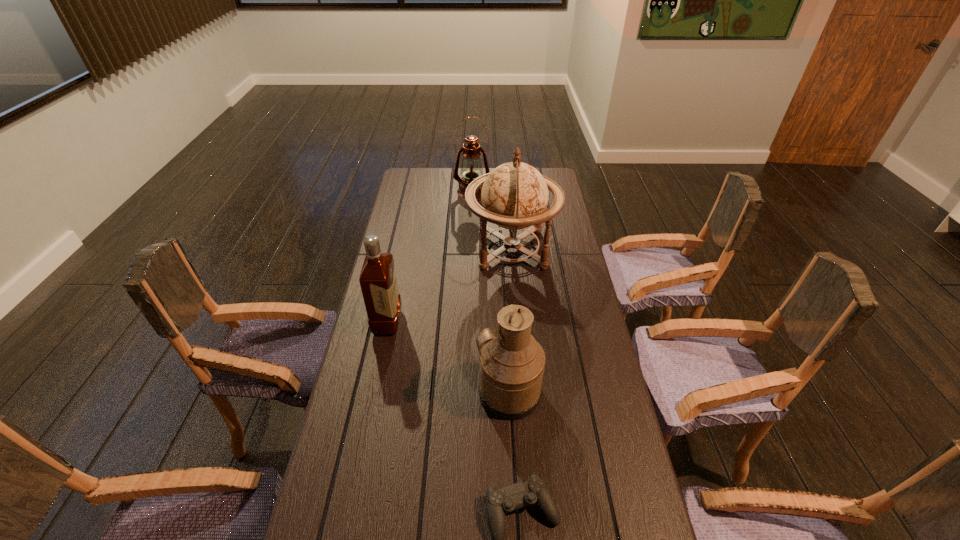
At what (x,y) coordinates should I click in order to perform the action: click on the tallest object. Please return your answer as a coordinate pair (x, y). The image size is (960, 540). Looking at the image, I should click on (514, 196).

The width and height of the screenshot is (960, 540). I want to click on the second farthest object, so click(x=514, y=196).

Where is `oil lamp`? oil lamp is located at coordinates (471, 168).

Locate an element on the screen. the leftmost object is located at coordinates (378, 281).

I want to click on liquor, so click(x=378, y=281).

I want to click on the fourth farthest object, so click(512, 363).

You are a GUI agent. You are given a task and a screenshot of the screen. Output one action in this format:
    pyautogui.click(x=<x>, y=<y>)
    Task: Click on the free spot located 0.140m on the front-facing side of the second farthest object
    This screenshot has width=960, height=540.
    Given the screenshot: What is the action you would take?
    pyautogui.click(x=431, y=249)

Find the location of a particular element. The image size is (960, 540). free location located on the front-facing side of the second farthest object is located at coordinates (400, 249).

The image size is (960, 540). In order to click on blank area located on the front-facing side of the second farthest object in this screenshot , I will do [x=411, y=249].

You are a GUI agent. You are given a task and a screenshot of the screen. Output one action in this format:
    pyautogui.click(x=<x>, y=<y>)
    Task: Click on the vacant area situated on the left of the oil lamp
    The width and height of the screenshot is (960, 540).
    Given the screenshot: What is the action you would take?
    pyautogui.click(x=401, y=192)